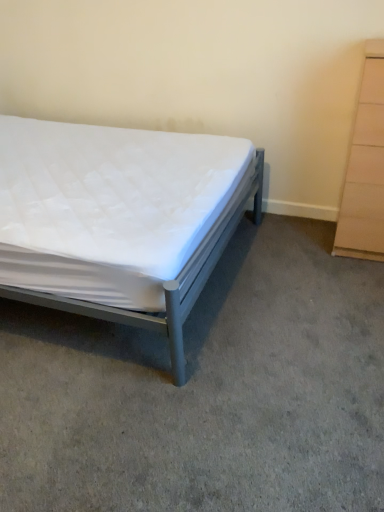
Where is `free space in front of beige wood chest of drawers at right`? free space in front of beige wood chest of drawers at right is located at coordinates (351, 277).